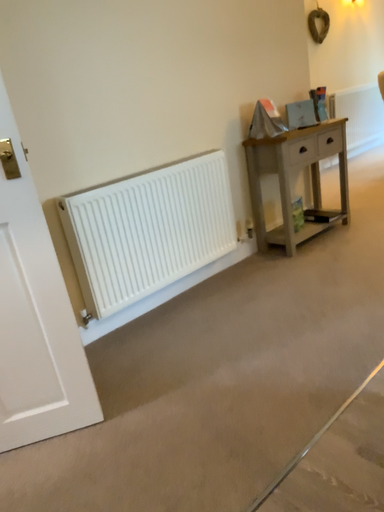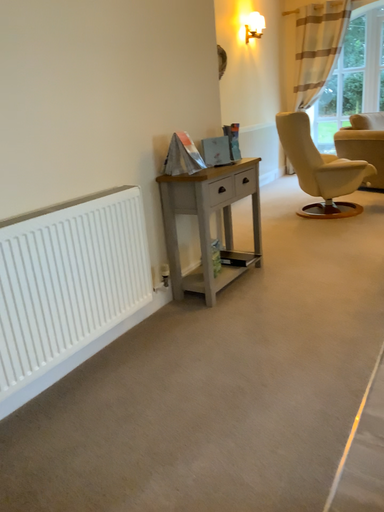
Question: How did the camera likely rotate when shooting the video?

Choices:
 (A) rotated right
 (B) rotated left

Answer: (A)